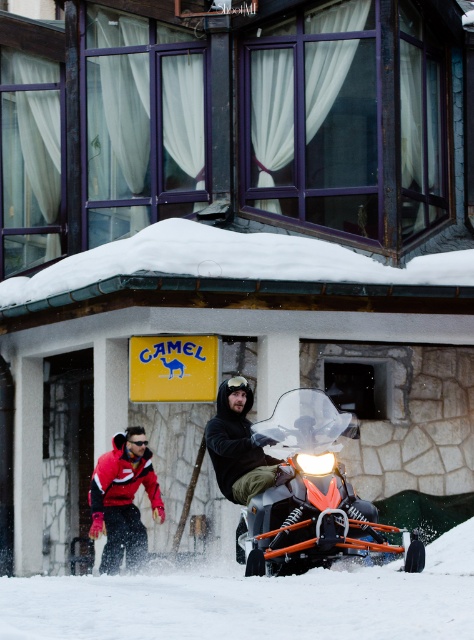
Question: Is red fleece jacket at lower left to the left of black matte jacket at center from the viewer's perspective?

Choices:
 (A) yes
 (B) no

Answer: (A)

Question: Which object appears farthest from the camera in this image?

Choices:
 (A) white powdery snow at lower center
 (B) red fleece jacket at lower left
 (C) orange metallic snowmobile at center

Answer: (B)

Question: Which point appears closest to the camera in this image?

Choices:
 (A) (166, 632)
 (B) (240, 500)
 (C) (126, 550)
 (D) (280, 531)

Answer: (A)

Question: Which object is closer to the camera taking this photo?

Choices:
 (A) black matte jacket at center
 (B) orange metallic snowmobile at center

Answer: (B)

Question: Does white powdery snow at lower center have a larger size compared to black matte jacket at center?

Choices:
 (A) no
 (B) yes

Answer: (B)

Question: Does white powdery snow at lower center appear over red fleece jacket at lower left?

Choices:
 (A) yes
 (B) no

Answer: (B)